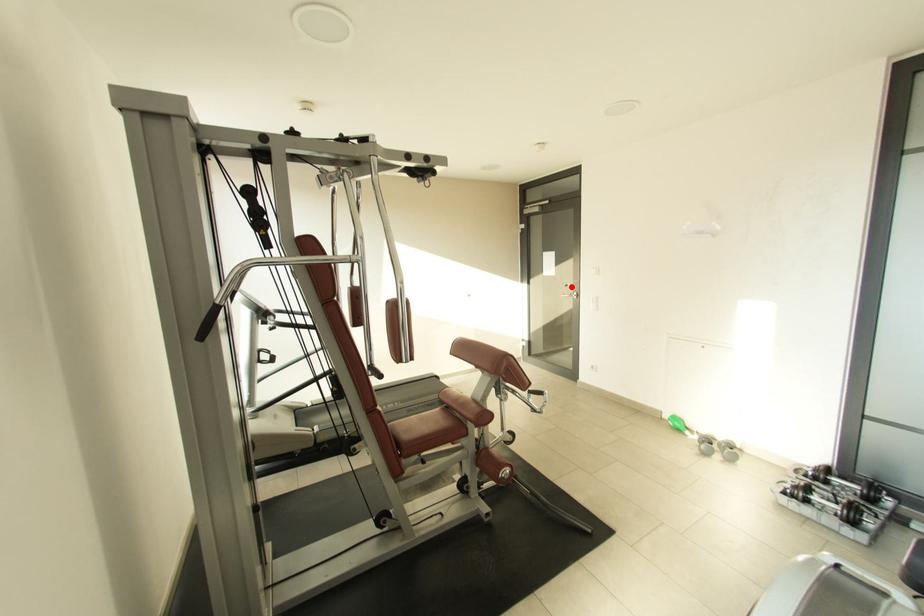
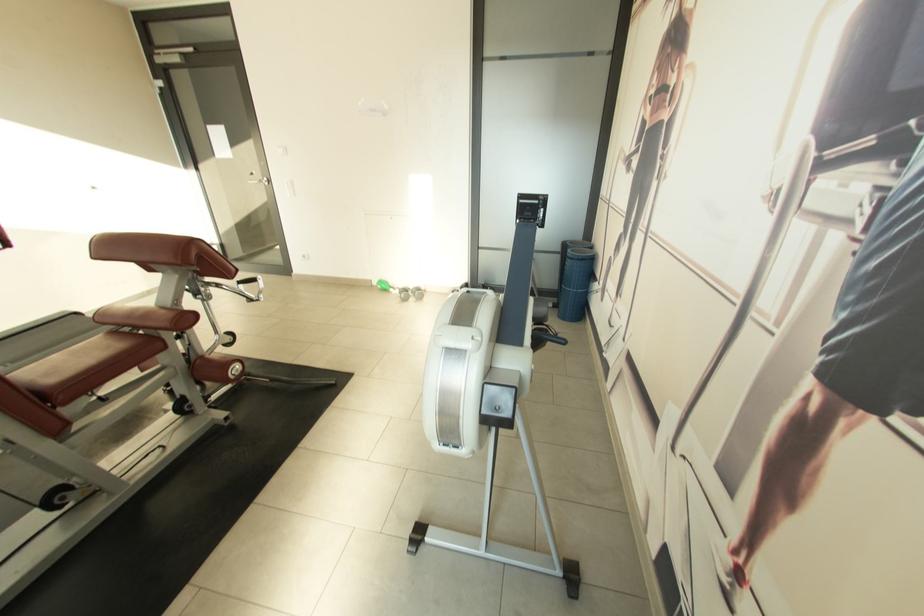
Where in the second image is the point corresponding to the highlighted location from the first image?

(258, 175)